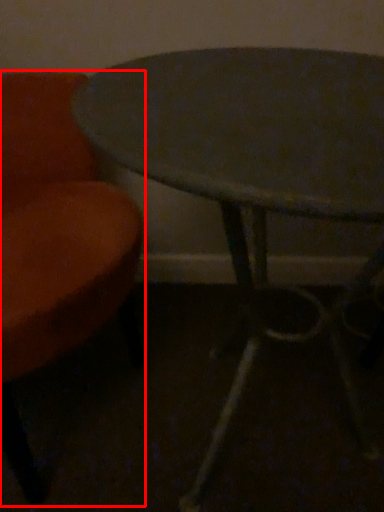
Question: In this image, where is chair (annotated by the red box) located relative to table?

Choices:
 (A) right
 (B) left

Answer: (B)